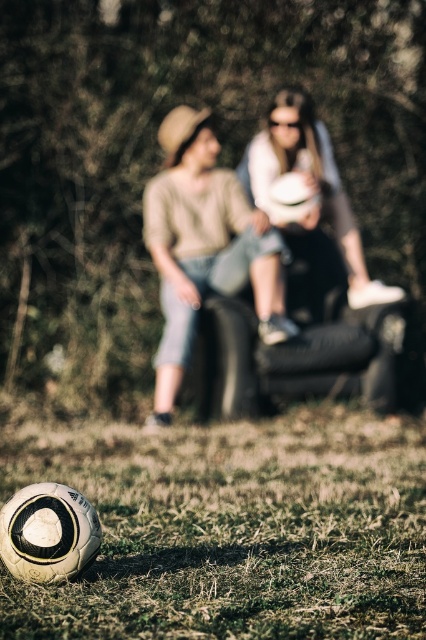
Is white matte soccer ball at lower left below denim jeans at center?

Yes, white matte soccer ball at lower left is below denim jeans at center.

Who is lower down, white matte soccer ball at lower left or denim jeans at center?

white matte soccer ball at lower left is below.

Which is behind, point (147, 636) or point (178, 138)?

The point (178, 138) is more distant.

Where is `white matte soccer ball at lower left`? This screenshot has height=640, width=426. white matte soccer ball at lower left is located at coordinates (230, 525).

Between white matte soccer ball at lower left and matte white ball at center, which one is positioned lower?

white matte soccer ball at lower left is lower down.

Which is in front, point (287, 472) or point (321, 236)?

Positioned in front is point (287, 472).

Which is behind, point (224, 435) or point (363, 291)?

The point (363, 291) is more distant.

Where is `white matte soccer ball at lower left`? This screenshot has height=640, width=426. white matte soccer ball at lower left is located at coordinates (230, 525).

Between point (261, 259) and point (319, 273), which one is positioned in front?

Point (261, 259) is in front.

Which is behind, point (250, 252) or point (331, 195)?

The point (331, 195) is behind.

I want to click on denim jeans at center, so pos(204,246).